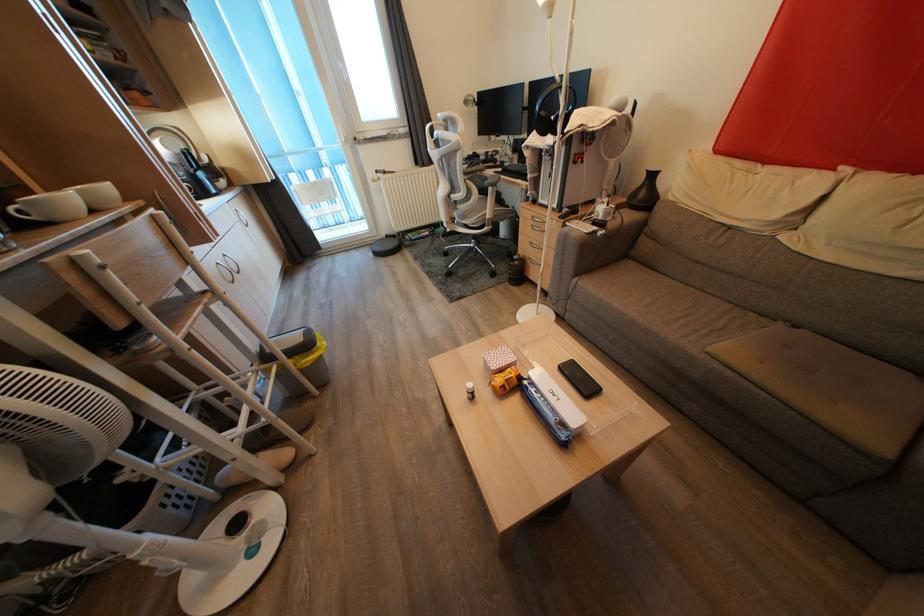
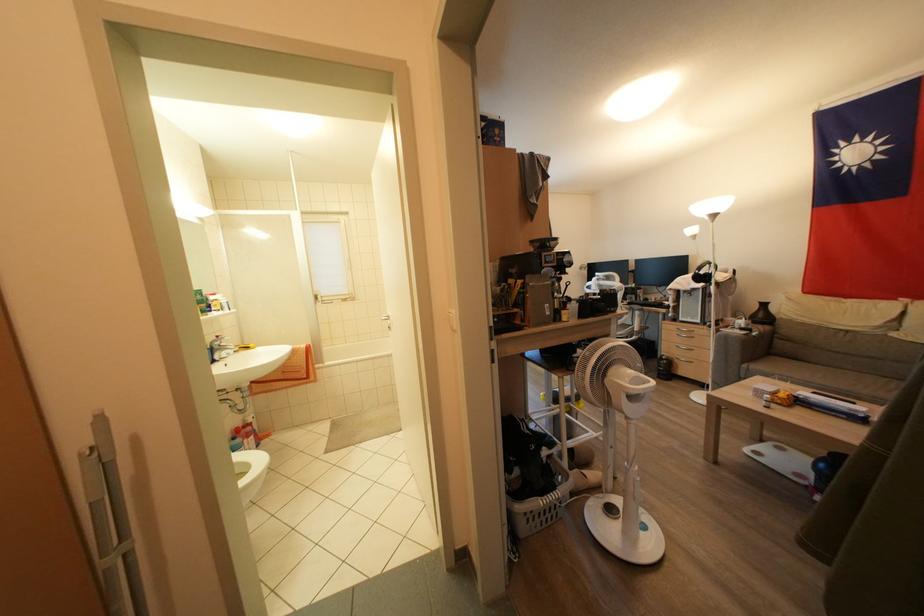
The point at (567, 428) is marked in the first image. Where is the corresponding point in the second image?

(858, 415)